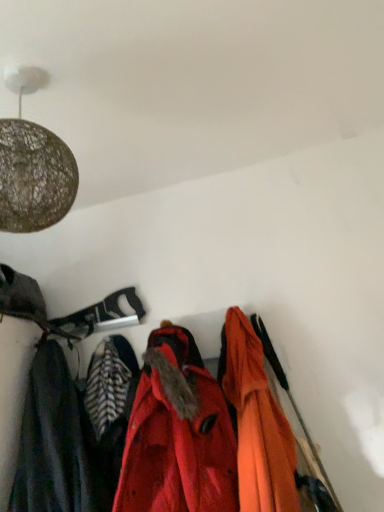
Question: Is orange matte jacket at center, the 1th jacket positioned from the right, at the back of red matte jacket at center, the 2th jacket positioned from the right?

Choices:
 (A) yes
 (B) no

Answer: (B)

Question: Is red matte jacket at center, placed as the first jacket when sorted from left to right, far away from orange matte jacket at center, the 1th jacket positioned from the right?

Choices:
 (A) yes
 (B) no

Answer: (B)

Question: Does red matte jacket at center, placed as the first jacket when sorted from left to right, appear on the right side of orange matte jacket at center, positioned as the second jacket in left-to-right order?

Choices:
 (A) yes
 (B) no

Answer: (B)

Question: Would you say red matte jacket at center, the 2th jacket positioned from the right, is outside orange matte jacket at center, the 1th jacket positioned from the right?

Choices:
 (A) no
 (B) yes

Answer: (B)

Question: Could you tell me if red matte jacket at center, placed as the first jacket when sorted from left to right, is turned towards orange matte jacket at center, the 1th jacket positioned from the right?

Choices:
 (A) yes
 (B) no

Answer: (B)

Question: Is dark gray fabric at left taller or shorter than red matte jacket at center, placed as the first jacket when sorted from left to right?

Choices:
 (A) short
 (B) tall

Answer: (A)

Question: Looking at their shapes, would you say dark gray fabric at left is wider or thinner than red matte jacket at center, the 2th jacket positioned from the right?

Choices:
 (A) wide
 (B) thin

Answer: (B)

Question: Visually, is dark gray fabric at left positioned to the left or to the right of red matte jacket at center, the 2th jacket positioned from the right?

Choices:
 (A) right
 (B) left

Answer: (B)

Question: In terms of size, does dark gray fabric at left appear bigger or smaller than red matte jacket at center, placed as the first jacket when sorted from left to right?

Choices:
 (A) small
 (B) big

Answer: (A)

Question: In terms of size, does red matte jacket at center, placed as the first jacket when sorted from left to right, appear bigger or smaller than orange matte jacket at center, the 1th jacket positioned from the right?

Choices:
 (A) small
 (B) big

Answer: (B)

Question: Based on their positions, is red matte jacket at center, the 2th jacket positioned from the right, located to the left or right of orange matte jacket at center, positioned as the second jacket in left-to-right order?

Choices:
 (A) right
 (B) left

Answer: (B)

Question: Which is correct: red matte jacket at center, the 2th jacket positioned from the right, is inside orange matte jacket at center, the 1th jacket positioned from the right, or outside of it?

Choices:
 (A) outside
 (B) inside

Answer: (A)

Question: From the image's perspective, is red matte jacket at center, the 2th jacket positioned from the right, positioned above or below orange matte jacket at center, the 1th jacket positioned from the right?

Choices:
 (A) below
 (B) above

Answer: (A)

Question: From a real-world perspective, is orange matte jacket at center, the 1th jacket positioned from the right, above or below red matte jacket at center, placed as the first jacket when sorted from left to right?

Choices:
 (A) above
 (B) below

Answer: (B)

Question: From their relative heights in the image, would you say orange matte jacket at center, the 1th jacket positioned from the right, is taller or shorter than red matte jacket at center, placed as the first jacket when sorted from left to right?

Choices:
 (A) tall
 (B) short

Answer: (B)